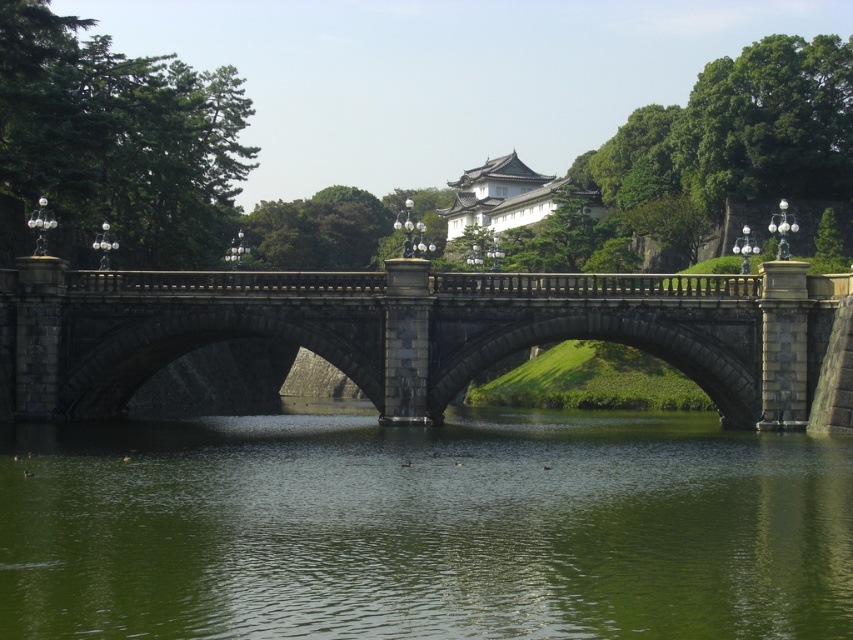
You are standing on the dark gray stone bridge at center and looking towards the green smooth water at center. Which direction should you walk to reach the water?

The green smooth water at center is positioned on the right side of dark gray stone bridge at center, so you should walk to the right to reach the green smooth water at center.

You are an architect analyzing the proportions of the scene. Given the green smooth water at center and the dark gray stone bridge at center, which object occupies a larger area in the image?

The dark gray stone bridge at center occupies a larger area in the image than the green smooth water at center, as the green smooth water at center is smaller than the dark gray stone stone bridge at center according to the description.

You are standing at the base of the stone bridge and looking towards the water. There are two points marked on the bridge structure. The first point is located at coordinates point (202, 516) and the second point is at point (254, 320). Which of these two points appears closer to you when viewed from your current position?

Point (202, 516) is closer to the camera than point (254, 320), so it appears closer to you when viewed from your current position at the base of the stone bridge.